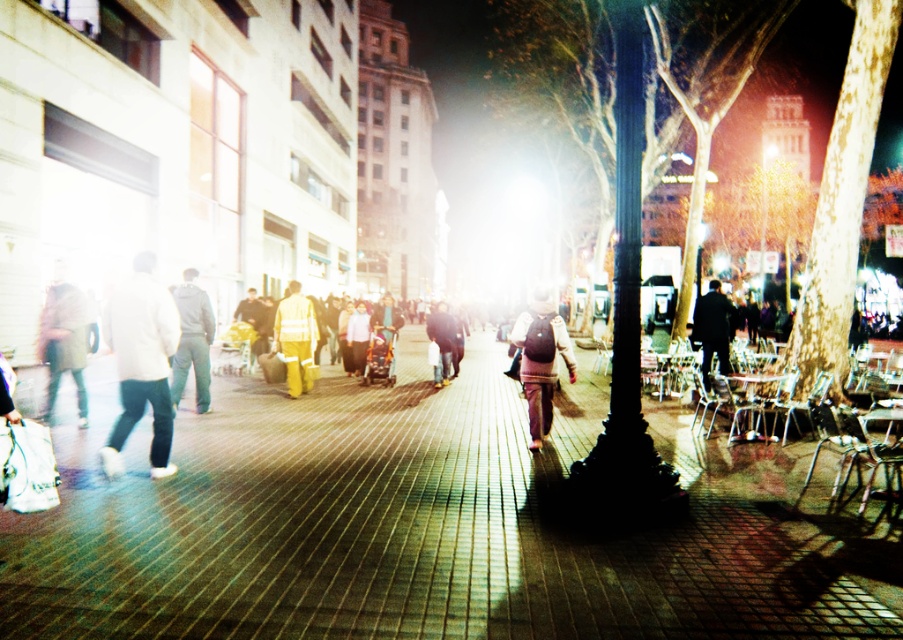
Question: Does white matte jacket at left appear on the left side of yellow reflective pants at center?

Choices:
 (A) no
 (B) yes

Answer: (B)

Question: Which object appears closest to the camera in this image?

Choices:
 (A) white matte jacket at left
 (B) dark gray jacket at center

Answer: (A)

Question: Is brown brick pavement at center thinner than yellow reflective pants at center?

Choices:
 (A) no
 (B) yes

Answer: (A)

Question: Does black polished pole at center appear on the right side of dark matte jacket at right?

Choices:
 (A) no
 (B) yes

Answer: (A)

Question: Among these objects, which one is farthest from the camera?

Choices:
 (A) matte brown backpack at center
 (B) matte khaki pants at left

Answer: (B)

Question: Among these points, which one is farthest from the camera?

Choices:
 (A) (183, 365)
 (B) (263, 337)
 (C) (116, 324)
 (D) (433, 328)

Answer: (B)